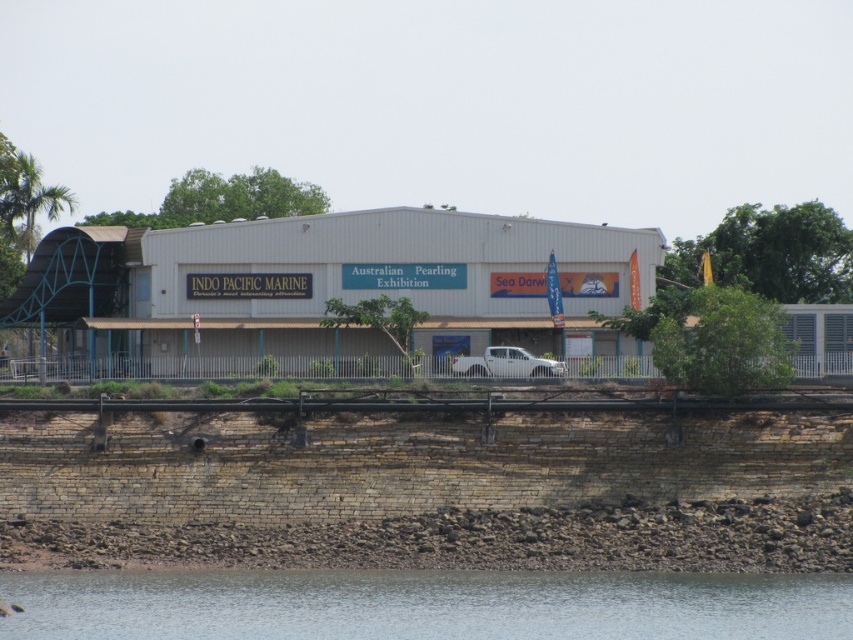
Question: Does clear water at lower center have a lesser width compared to white matte truck at center?

Choices:
 (A) yes
 (B) no

Answer: (B)

Question: Among these points, which one is nearest to the camera?

Choices:
 (A) (519, 371)
 (B) (224, 618)

Answer: (B)

Question: Does clear water at lower center appear under white matte truck at center?

Choices:
 (A) yes
 (B) no

Answer: (A)

Question: Is clear water at lower center below white matte truck at center?

Choices:
 (A) yes
 (B) no

Answer: (A)

Question: Which object is closer to the camera taking this photo?

Choices:
 (A) clear water at lower center
 (B) white matte truck at center

Answer: (A)